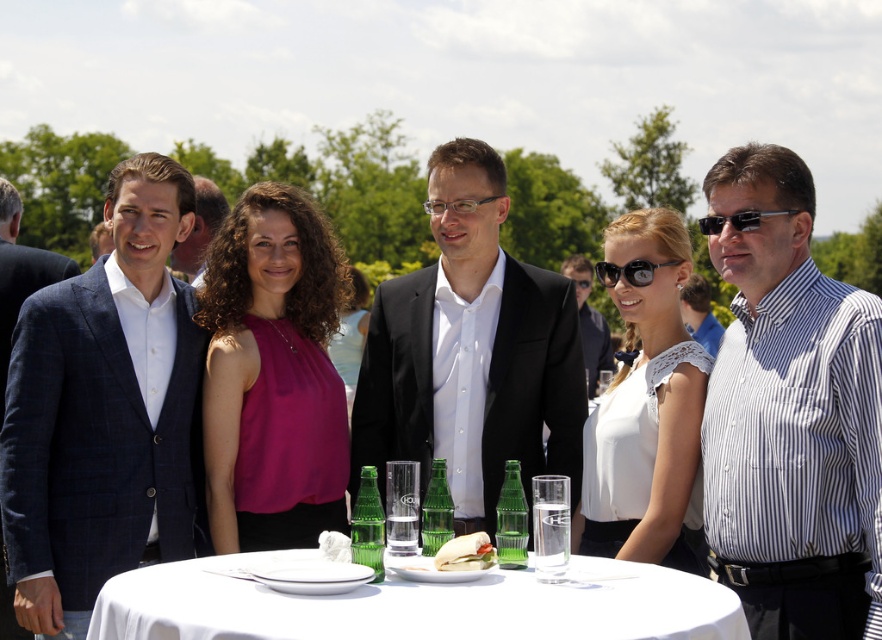
Question: Based on their relative distances, which object is farther from the striped cotton shirt at right?

Choices:
 (A) white cloth table at center
 (B) black matte suit at center

Answer: (A)

Question: Can you confirm if black matte suit at center is thinner than dark blue checkered suit at left?

Choices:
 (A) no
 (B) yes

Answer: (A)

Question: Estimate the real-world distances between objects in this image. Which object is closer to the black plastic sunglasses at right?

Choices:
 (A) pink satin blouse at center
 (B) white striped shirt at right
 (C) striped cotton shirt at right

Answer: (B)

Question: Is black matte suit at center to the left of matte black suit at left from the viewer's perspective?

Choices:
 (A) yes
 (B) no

Answer: (B)

Question: Which of the following is the closest to the observer?

Choices:
 (A) (704, 291)
 (B) (729, 570)
 (C) (103, 376)

Answer: (B)

Question: Does black matte suit at center appear on the right side of matte green sandwich at center?

Choices:
 (A) yes
 (B) no

Answer: (A)